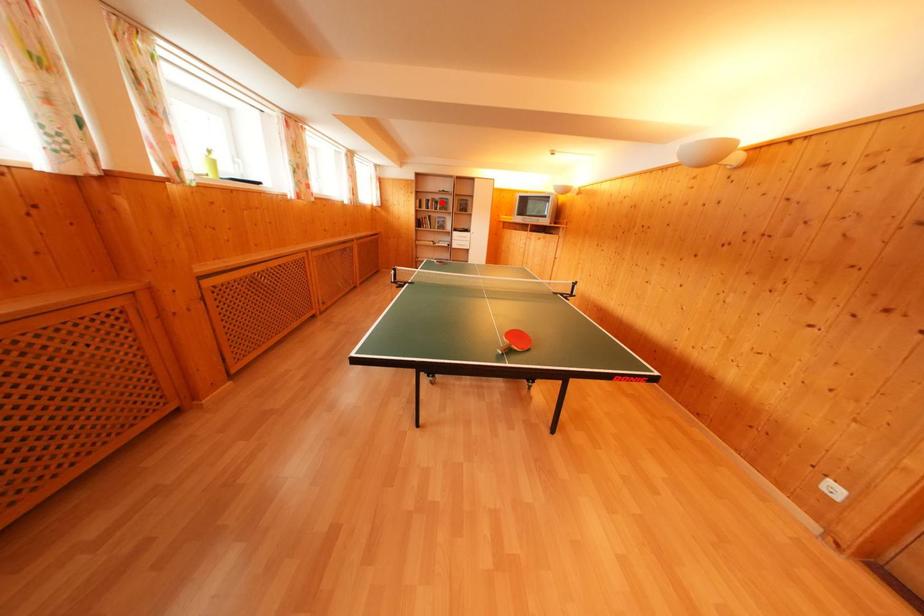
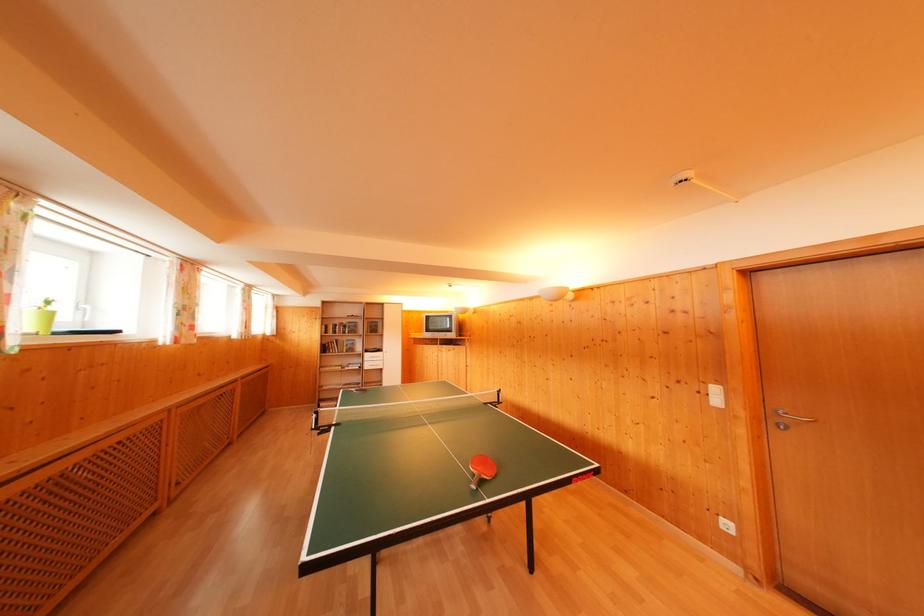
The point at the highlighted location is marked in the first image. Where is the corresponding point in the second image?

(349, 326)